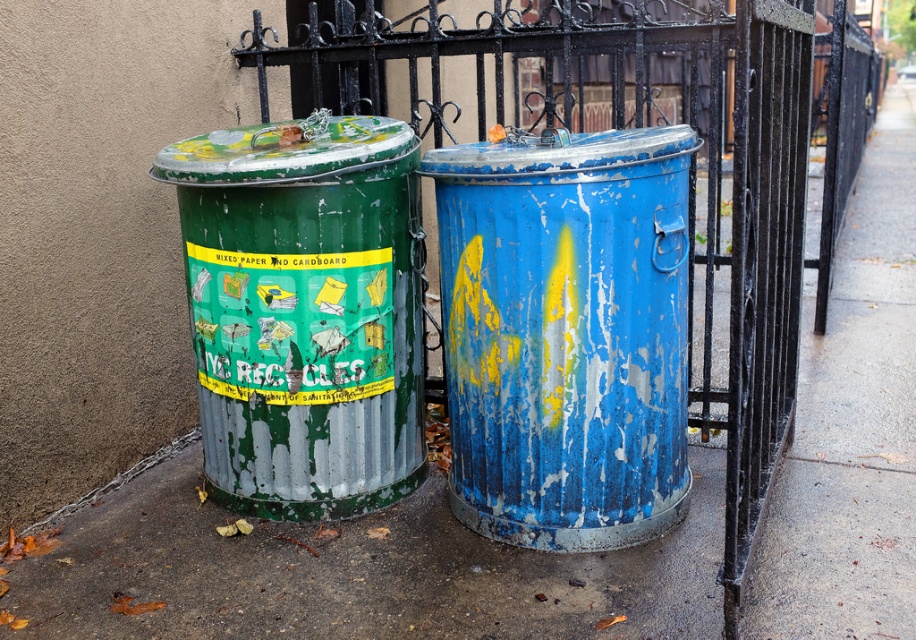
Based on the photo, you are standing in front of the two trash bins and want to walk towards the brushed metal fence at center. Which direction should you move relative to the trash bins?

The brushed metal fence at center is located at point coordinates, so you should move towards the center area between the two trash bins to reach it.

You are standing in front of the rusty metal trash can at center. You need to throw a piece of paper that is 3 meters away from you. Can you reach it without moving?

The distance between you and the rusty metal trash can at center is 2.80 meters. Since the paper is 3 meters away, it is 0.20 meters beyond the trash can, so you cannot reach it without moving.